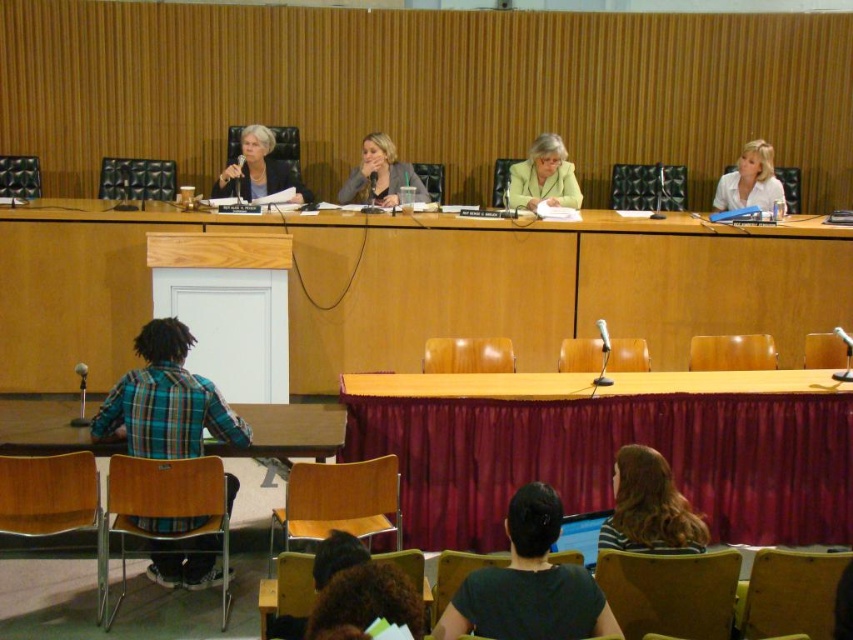
You are an attendee at the panel discussion and want to identify the speaker wearing the matte yellow jacket at center and the one in the white matte shirt at upper right. Based on their positions, which speaker is seated to the left of the other?

The matte yellow jacket at center is positioned on the left side of white matte shirt at upper right, so the speaker in the matte yellow jacket at center is seated to the left of the speaker in the white matte shirt at upper right.

You are attending a formal event and need to choose an outfit that is less attention grabbing. Based on the scene, which item would you select between the matte yellow jacket at center and the white matte shirt at upper right?

The matte yellow jacket at center has a smaller size compared to white matte shirt at upper right, so the white matte shirt at upper right is larger and might be more attention grabbing. Therefore, the matte yellow jacket at center would be the less attention grabbing option.

You are sitting in the audience and want to wave to both the plaid fabric shirt at lower left and the striped fabric shirt at lower center. Which one should you wave to first to ensure they both see you?

You should wave to the plaid fabric shirt at lower left first because it is closer to you, so they will see you first, and then the striped fabric shirt at lower center will also notice your wave since they are further back but still within view.